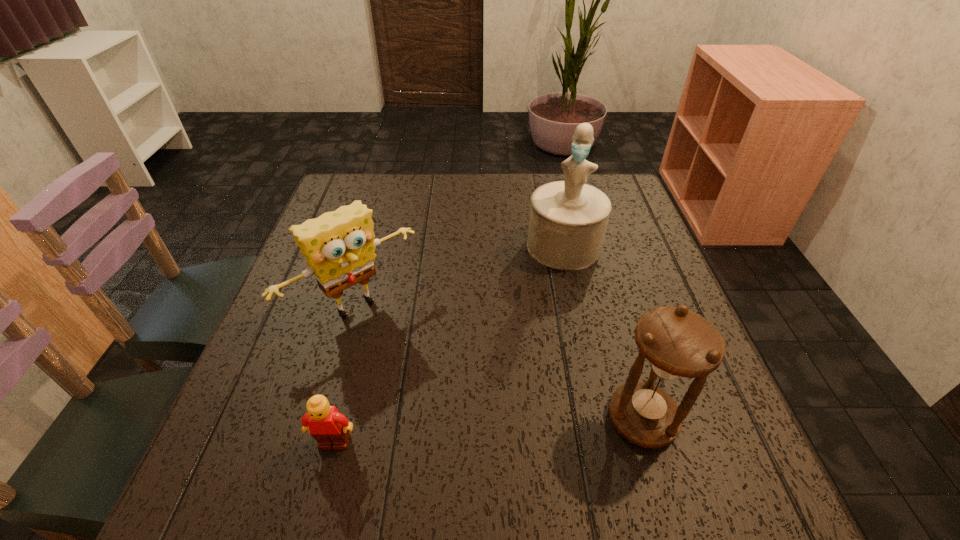
Locate an element on the screen. vacant spot on the desktop that is between the Lego and the hourglass and is positioned at the beak of the figurine is located at coordinates (520, 428).

I want to click on free spot on the desktop that is between the Lego and the hourglass and is positioned on the face of the second farthest object, so click(x=467, y=432).